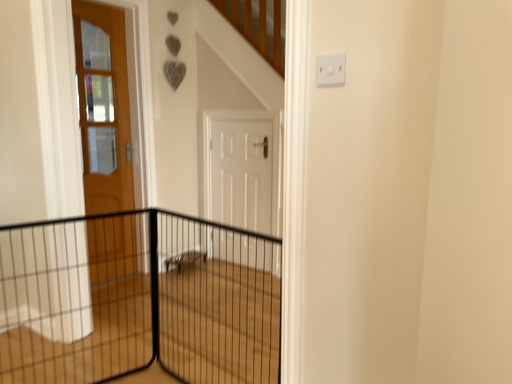
Image resolution: width=512 pixels, height=384 pixels. What are the coordinates of `free space to the back side of black wire mesh fence at left` in the screenshot? It's located at (103, 357).